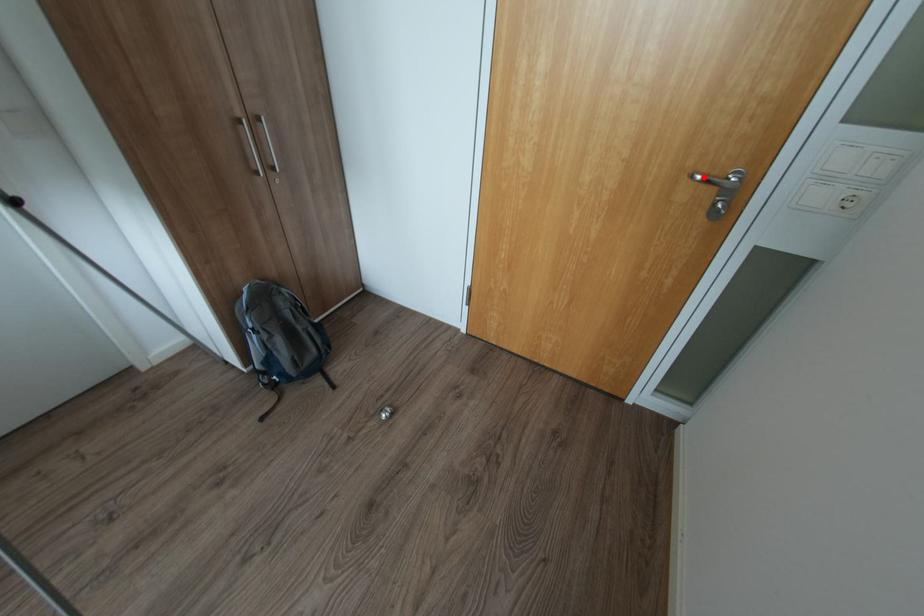
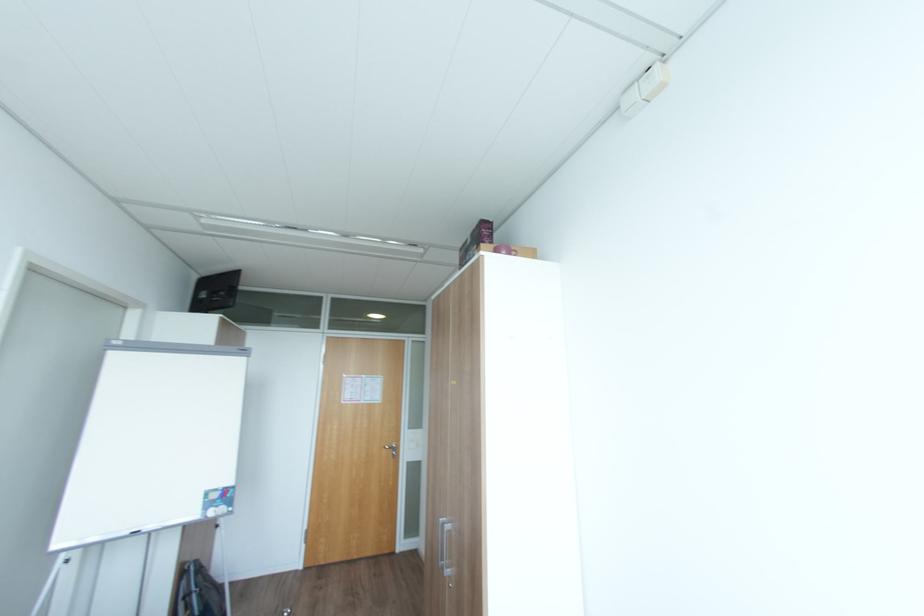
Question: I am providing you with two images of the same scene from different viewpoints. In image1, a red point is highlighted. Considering the same 3D point in image2, which of the following is correct?

Choices:
 (A) It is closer
 (B) It is farther

Answer: (B)